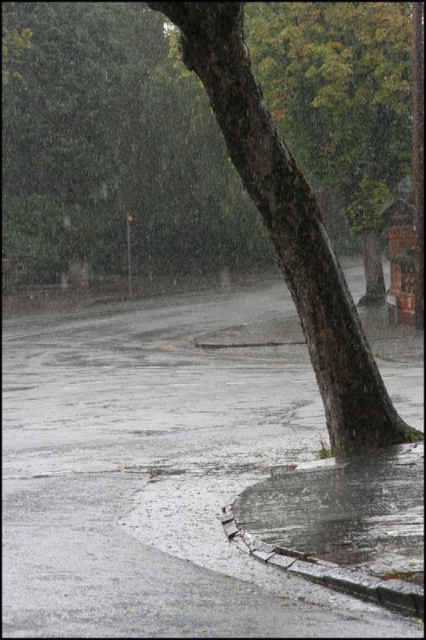
Question: Which of the following is the closest to the observer?

Choices:
 (A) smooth brown tree trunk at center
 (B) wet asphalt at lower center
 (C) glossy concrete puddle at lower center
 (D) smooth bark tree at center

Answer: (B)

Question: Can you confirm if wet asphalt at lower center is smaller than smooth bark tree at center?

Choices:
 (A) no
 (B) yes

Answer: (B)

Question: Which object is positioned closest to the glossy concrete puddle at lower center?

Choices:
 (A) wet asphalt at lower center
 (B) smooth bark tree at center

Answer: (A)

Question: Is smooth bark tree at center to the left of glossy concrete puddle at lower center from the viewer's perspective?

Choices:
 (A) no
 (B) yes

Answer: (B)

Question: Can you confirm if smooth bark tree at center is positioned below glossy concrete puddle at lower center?

Choices:
 (A) yes
 (B) no

Answer: (B)

Question: Among these objects, which one is farthest from the camera?

Choices:
 (A) smooth bark tree at center
 (B) smooth brown tree trunk at center

Answer: (A)